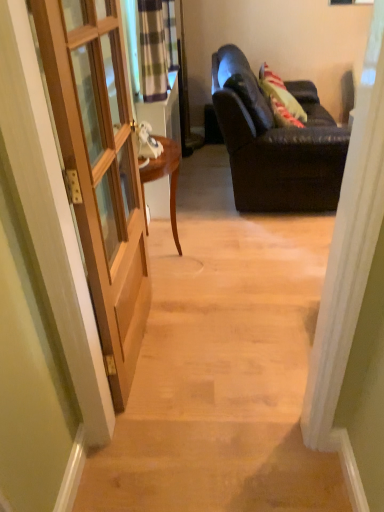
What are the coordinates of `free space between wooden door at left and dark brown leather couch at right` in the screenshot? It's located at (235, 257).